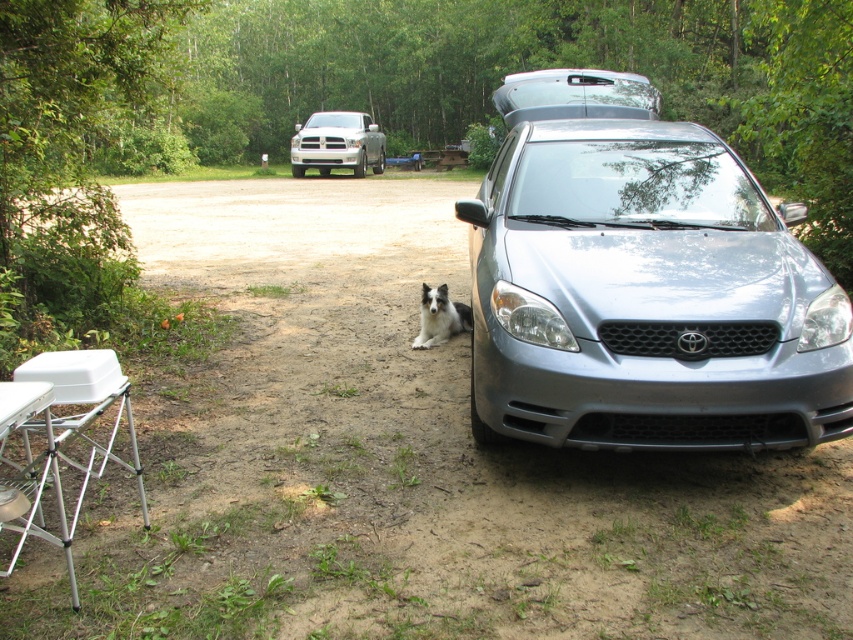
You are driving a car and want to pass through the road where the satin silver minivan at upper center and silver metallic truck at upper center are located. Based on their positions, which vehicle should you be cautious of overtaking first?

The satin silver minivan at upper center is in front of the silver metallic truck at upper center, so you should be cautious of overtaking the satin silver minivan at upper center first before considering the silver metallic truck at upper center.

You are standing at the point labeled as point (315, 116) and want to walk to the point labeled as point (120, 413). Which direction should you move relative to the silver Toyota car parked on the right side of the road?

You should move towards the front of the silver Toyota car parked on the right side of the road because point (120, 413) is in front of point (315, 116).